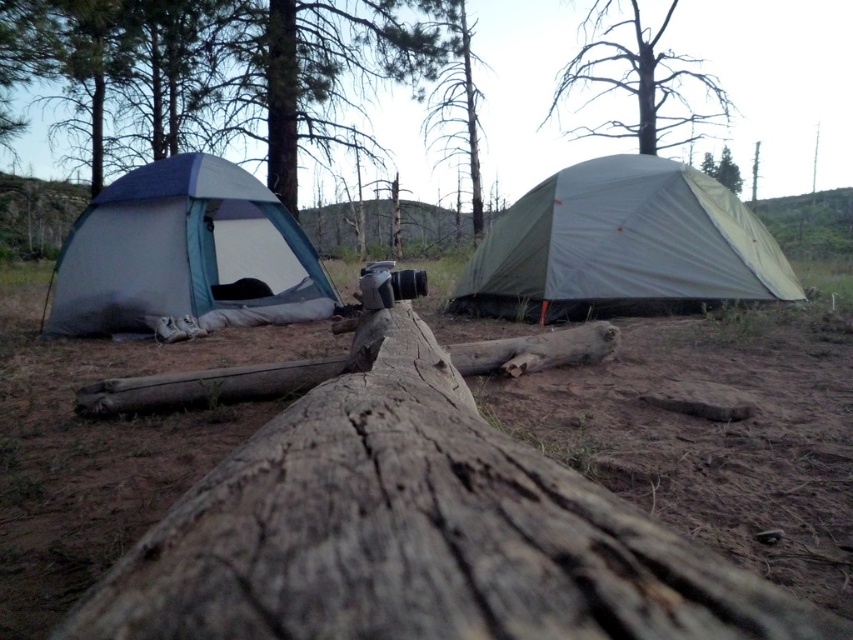
You are a hiker trying to set up a tent in the camping scene. You want to place your tent as close as possible to the rough textured log at center without being directly on top of it. Where should you position your tent relative to the log?

The rough textured log at center is located at coordinates point (415, 532). To place your tent as close as possible without being directly on top, position it near the log but slightly offset from those coordinates.

You are a hiker who wants to use the dead wood tree at upper center as a support to climb up to a higher elevation. However, you notice the rough textured log at center nearby. Which object is shorter in height and therefore safer to use as a stepping stool?

The rough textured log at center is not as tall as the dead wood tree at upper center, so the rough textured log at center is shorter and safer to use as a stepping stool.

You are standing at the point marked as point (636, 77) in the image. What object are you standing on?

You are standing on the dead wood tree at upper center.